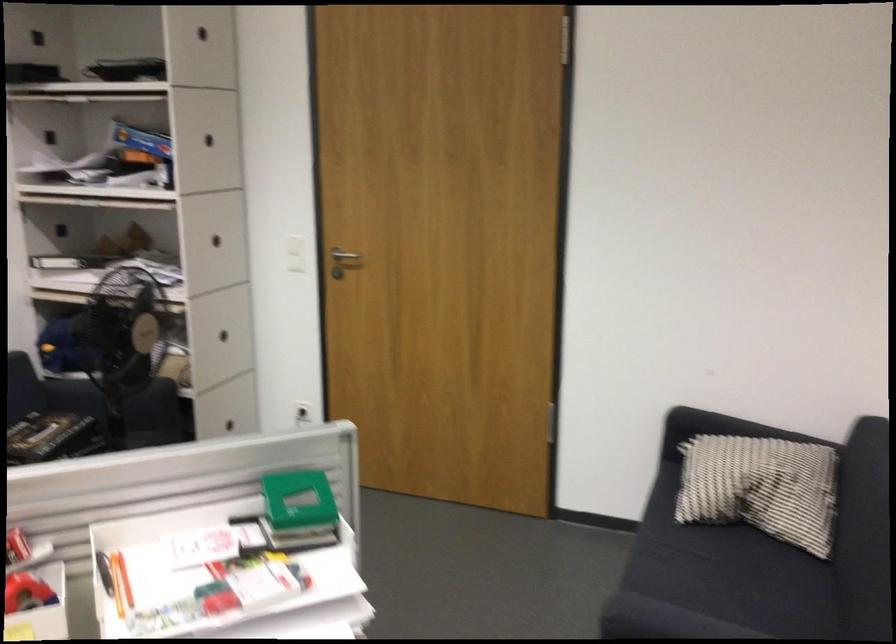
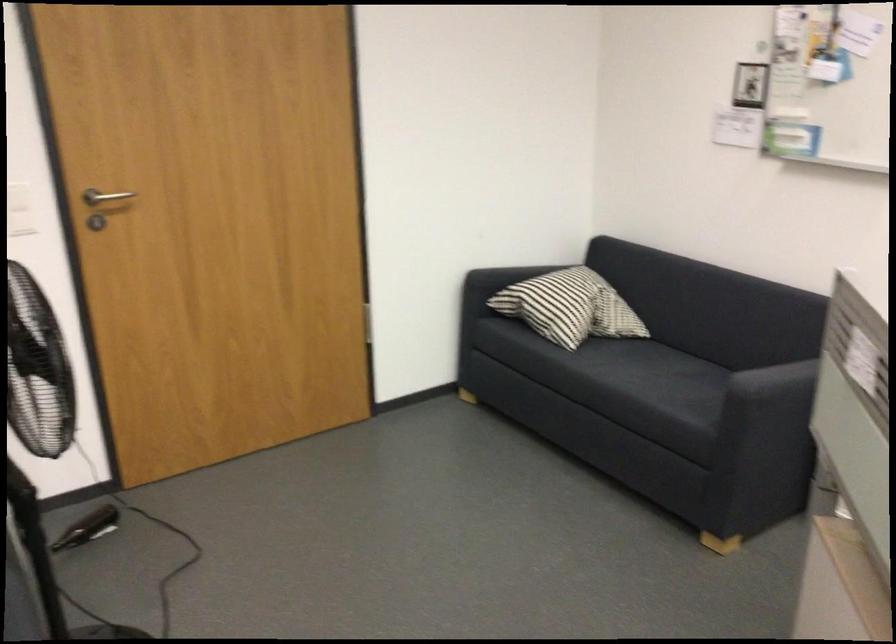
The point at (716, 480) is marked in the first image. Where is the corresponding point in the second image?

(570, 307)